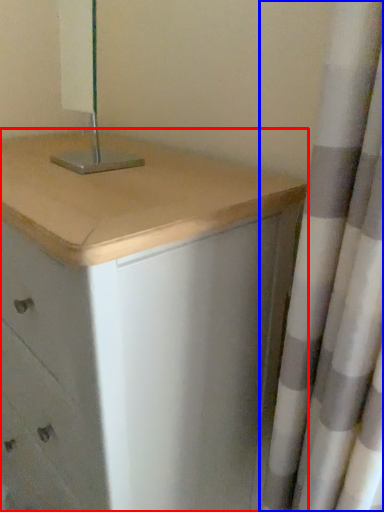
Question: Which of the following is the closest to the observer, chest of drawers (highlighted by a red box) or curtain (highlighted by a blue box)?

Choices:
 (A) chest of drawers
 (B) curtain

Answer: (B)